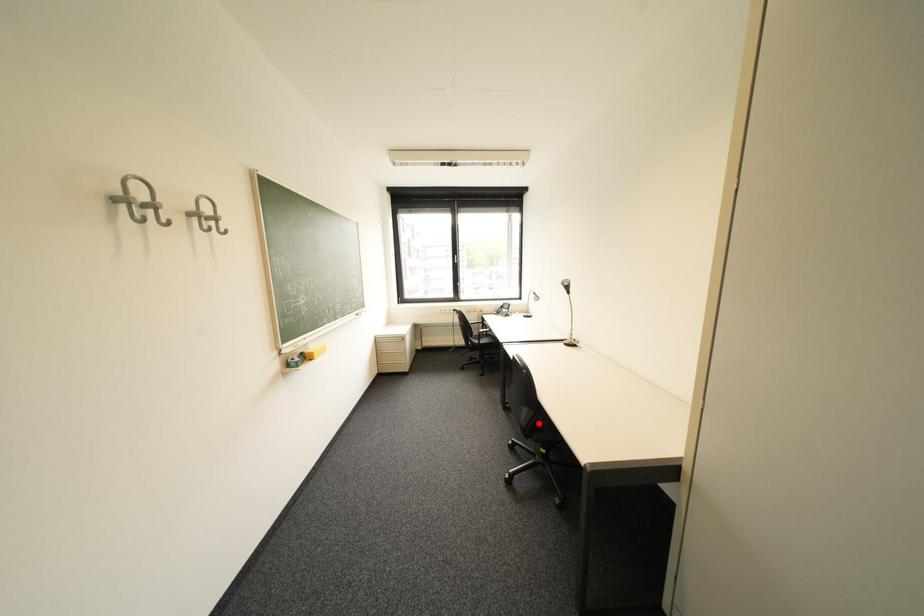
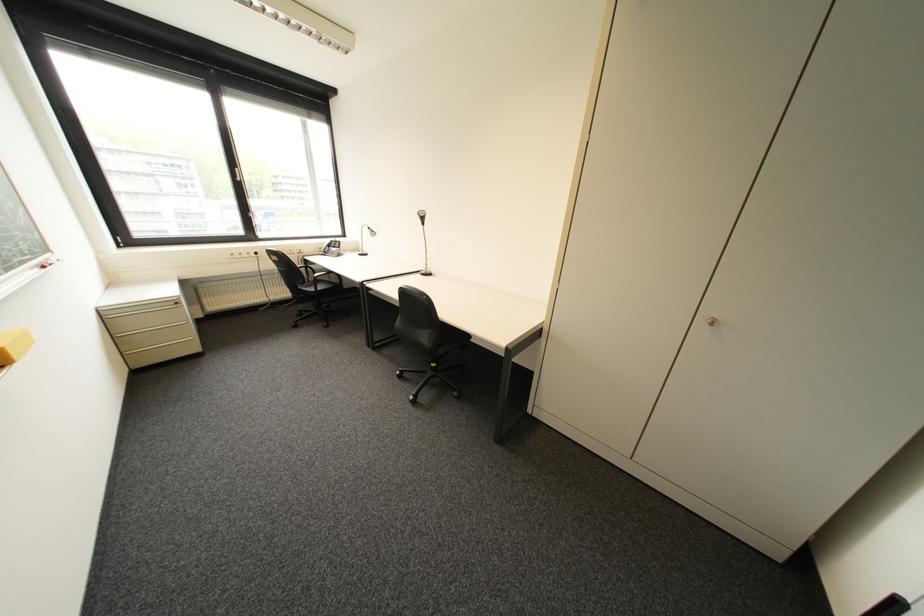
Locate, in the second image, the point that corresponds to the highlighted location in the first image.

(444, 342)